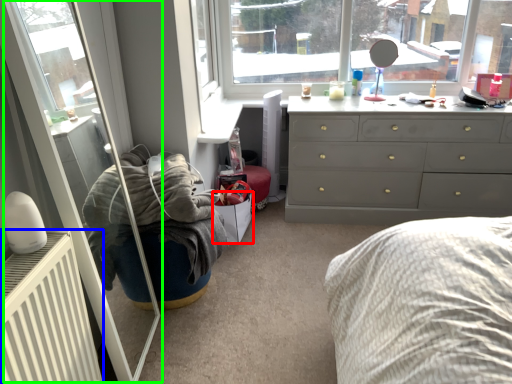
Question: Which is farther away from shoe box (highlighted by a red box)? radiator (highlighted by a blue box) or screen door (highlighted by a green box)?

Choices:
 (A) radiator
 (B) screen door

Answer: (A)